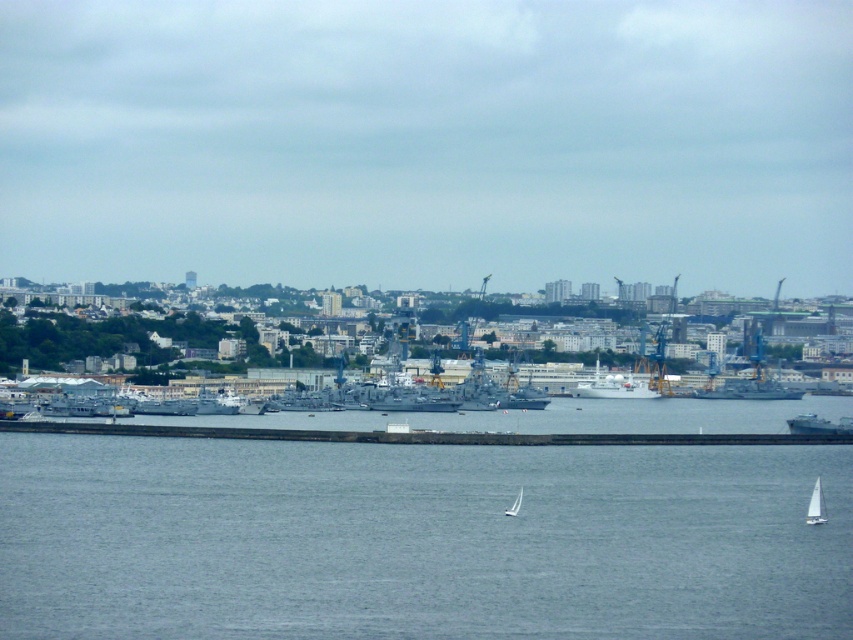
How distant is white matte sailboat at lower right from white matte sailboat at center?

They are 83.31 meters apart.

Is white matte sailboat at lower right above white matte sailboat at center?

Incorrect, white matte sailboat at lower right is not positioned above white matte sailboat at center.

What do you see at coordinates (815, 506) in the screenshot? I see `white matte sailboat at lower right` at bounding box center [815, 506].

You are a GUI agent. You are given a task and a screenshot of the screen. Output one action in this format:
    pyautogui.click(x=<x>, y=<y>)
    Task: Click on the white matte sailboat at lower right
    
    Given the screenshot: What is the action you would take?
    pyautogui.click(x=815, y=506)

Measure the distance between white matte ship at center and camera.

white matte ship at center and camera are 653.47 meters apart from each other.

Is point (573, 388) positioned after point (849, 422)?

No, it is not.

Does point (637, 388) come in front of point (840, 433)?

Yes, point (637, 388) is closer to viewer.

Image resolution: width=853 pixels, height=640 pixels. In order to click on white matte ship at center in this screenshot , I will do [x=613, y=387].

Where is `blue water at lower center`? This screenshot has height=640, width=853. blue water at lower center is located at coordinates pos(418,540).